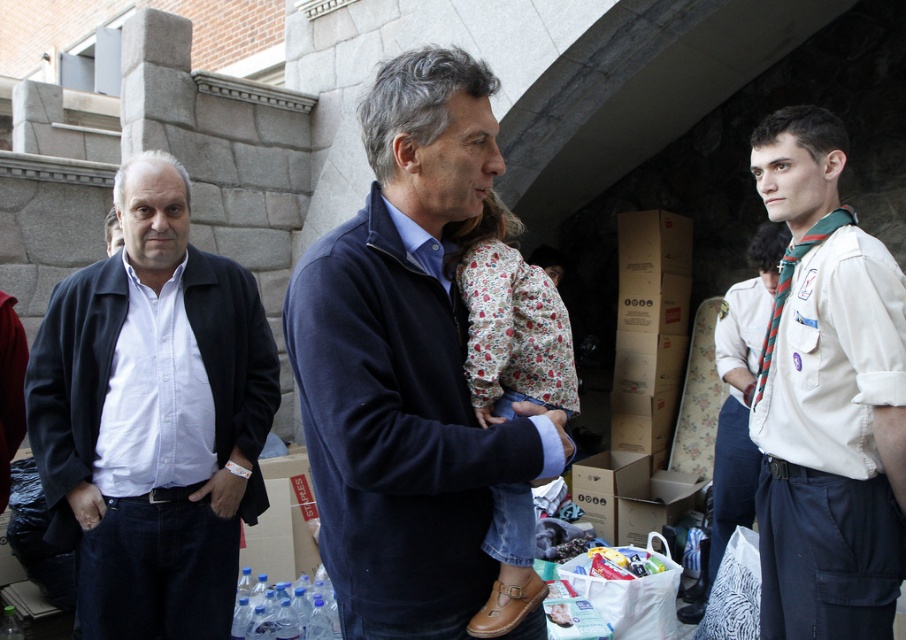
You are standing in the scene and want to locate the dark blue sweater at center. According to the coordinates provided, where would you find it?

The dark blue sweater at center is located at the 2D coordinates point [407,365].

You are a photographer at the event and want to capture a photo that includes both the man in dark blue sweater and light blue shirt holding the girl and the white cotton shirt at right. What is the minimum distance you need to move backward to include both in the frame?

The two subjects are 3.24 meters apart. To include both in the frame, the photographer must move back at least enough to cover this distance in the camera view.

You are taking a photo of the scene and want to focus on both the point at (348, 275) and the point at (92, 397). Which point should you adjust your focus to first if you want to ensure both are in clear view?

You should focus on point (348, 275) first because it is closer to the camera than point (92, 397), and adjusting focus from near to far can help ensure both points are in clear view.